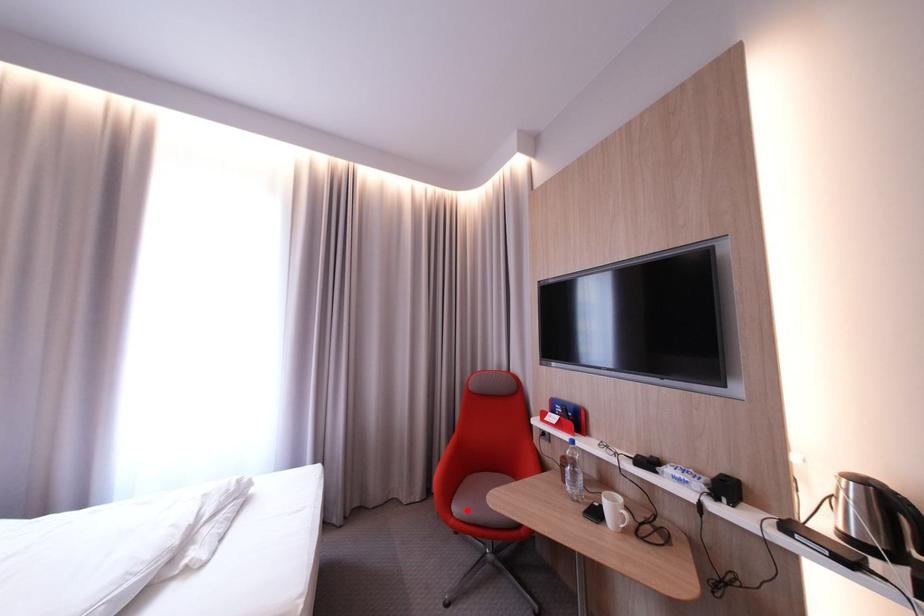
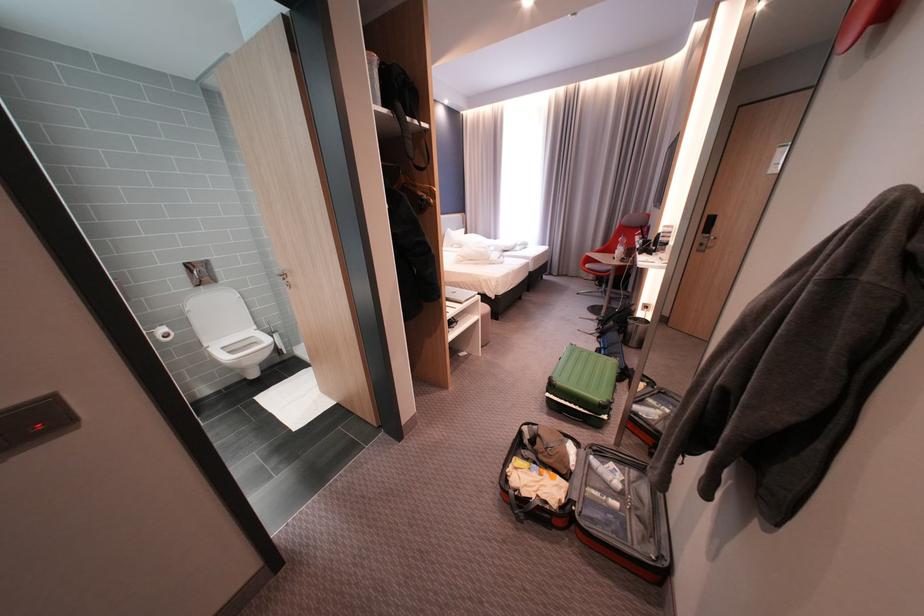
Find the pixel in the second image that matches the highlighted location in the first image.

(598, 265)